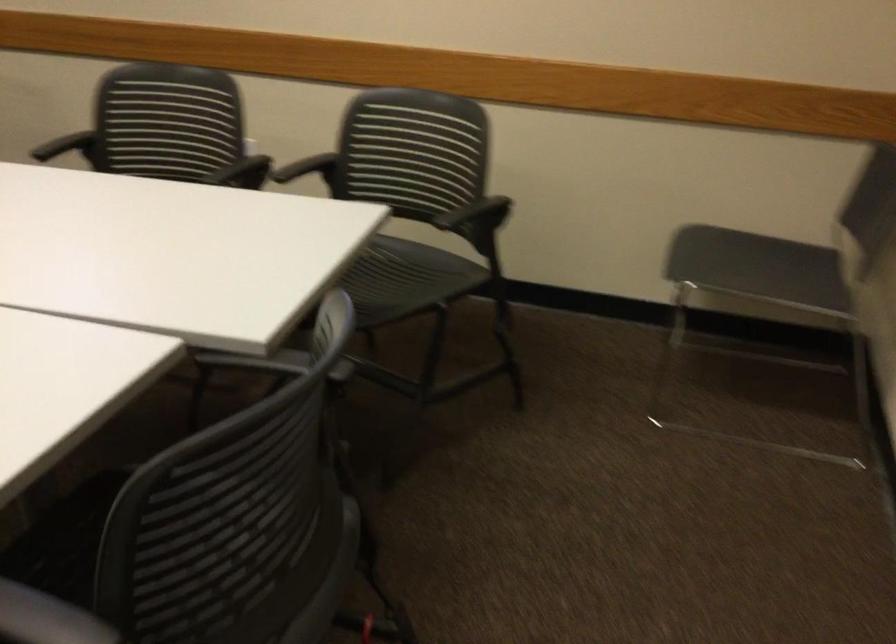
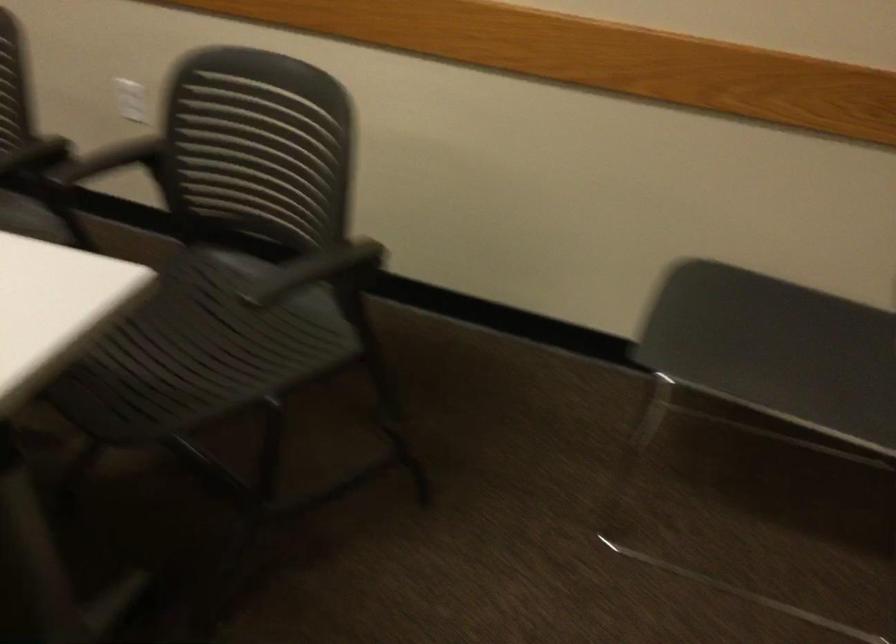
Locate, in the second image, the point that corresponds to (719,257) in the first image.

(714, 323)